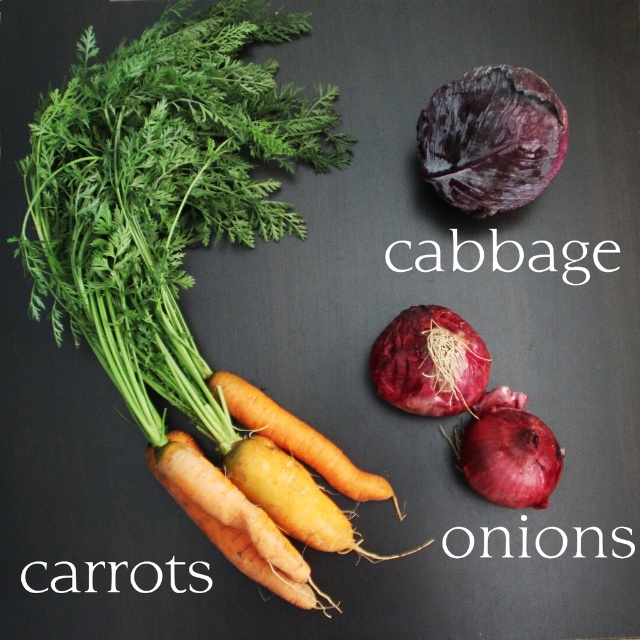
Is orange smooth carrots at lower left above shiny purple onion at center right?

No.

Who is taller, orange smooth carrots at lower left or shiny purple onion at center right?

orange smooth carrots at lower left is taller.

Image resolution: width=640 pixels, height=640 pixels. I want to click on orange smooth carrots at lower left, so click(x=232, y=520).

Find the location of `orange smooth carrots at lower left`. orange smooth carrots at lower left is located at coordinates (232, 520).

How much distance is there between purple/red textured cabbage at upper right and shiny purple onion at center right?

purple/red textured cabbage at upper right is 12.90 inches away from shiny purple onion at center right.

Which is above, purple/red textured cabbage at upper right or shiny purple onion at center right?

Positioned higher is purple/red textured cabbage at upper right.

At what (x,y) coordinates should I click in order to perform the action: click on purple/red textured cabbage at upper right. Please return your answer as a coordinate pair (x, y). The width and height of the screenshot is (640, 640). Looking at the image, I should click on (492, 138).

Does purple matte onion at center have a greater width compared to orange matte carrots at center?

In fact, purple matte onion at center might be narrower than orange matte carrots at center.

Which is below, purple matte onion at center or orange matte carrots at center?

orange matte carrots at center is below.

Between point (428, 305) and point (228, 396), which one is positioned behind?

Positioned behind is point (428, 305).

Find the location of a particular element. The width and height of the screenshot is (640, 640). purple matte onion at center is located at coordinates (429, 362).